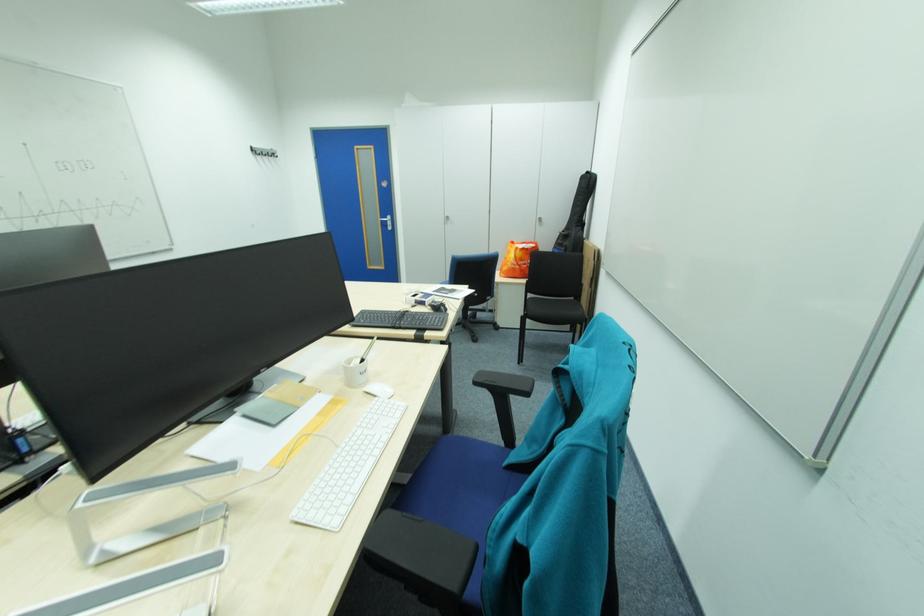
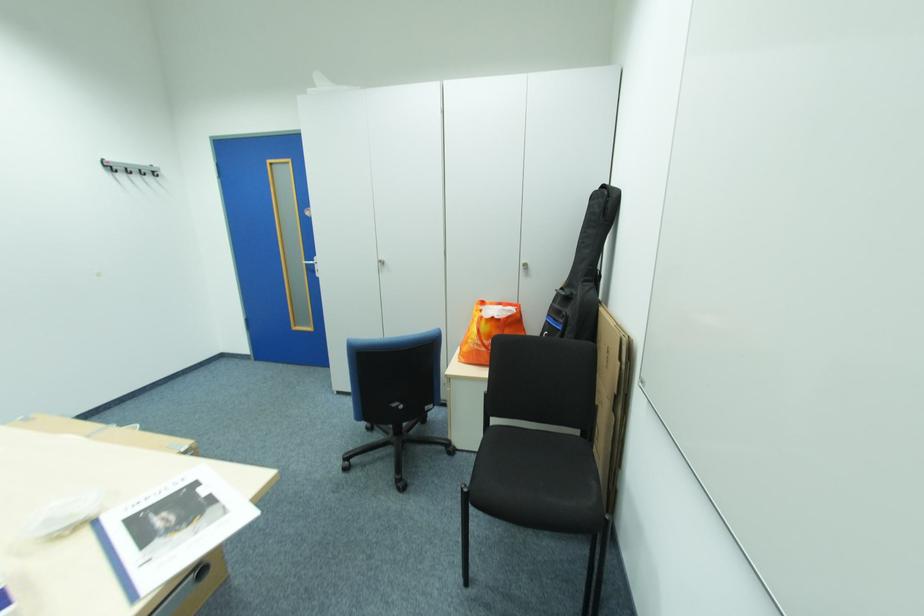
Locate, in the second image, the point that corresponds to pixel 390 221 in the first image.

(314, 265)